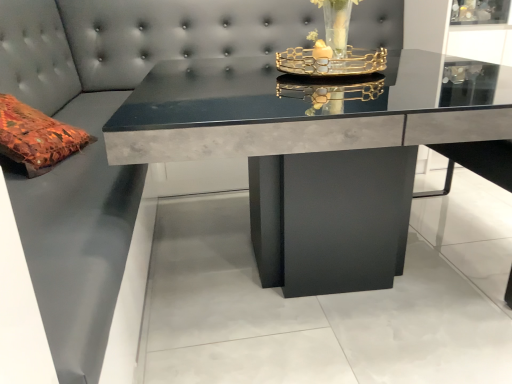
Question: Does matte concrete table at center have a greater width compared to gold metallic tray at center?

Choices:
 (A) yes
 (B) no

Answer: (A)

Question: Can gold metallic tray at center be found inside matte concrete table at center?

Choices:
 (A) yes
 (B) no

Answer: (B)

Question: Does matte concrete table at center have a lesser height compared to gold metallic tray at center?

Choices:
 (A) no
 (B) yes

Answer: (A)

Question: Is matte concrete table at center closer to camera compared to gold metallic tray at center?

Choices:
 (A) yes
 (B) no

Answer: (A)

Question: Are matte concrete table at center and gold metallic tray at center beside each other?

Choices:
 (A) no
 (B) yes

Answer: (A)

Question: Is matte concrete table at center to the left of gold metallic tray at center from the viewer's perspective?

Choices:
 (A) yes
 (B) no

Answer: (A)

Question: Can you confirm if gold metallic tray at center is wider than matte concrete table at center?

Choices:
 (A) yes
 (B) no

Answer: (B)

Question: Does gold metallic tray at center have a greater height compared to matte concrete table at center?

Choices:
 (A) no
 (B) yes

Answer: (A)

Question: Is the position of gold metallic tray at center more distant than that of matte concrete table at center?

Choices:
 (A) no
 (B) yes

Answer: (B)

Question: Is gold metallic tray at center next to matte concrete table at center?

Choices:
 (A) no
 (B) yes

Answer: (A)

Question: From the image's perspective, is gold metallic tray at center located beneath matte concrete table at center?

Choices:
 (A) no
 (B) yes

Answer: (A)

Question: From a real-world perspective, is gold metallic tray at center located higher than matte concrete table at center?

Choices:
 (A) yes
 (B) no

Answer: (A)

Question: Looking at their shapes, would you say matte concrete table at center is wider or thinner than gold metallic tray at center?

Choices:
 (A) thin
 (B) wide

Answer: (B)